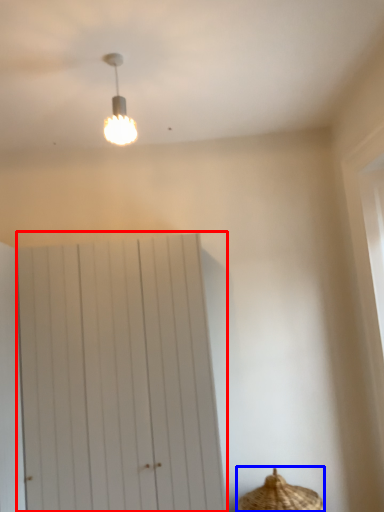
Question: Which of the following is the closest to the observer, barn door (highlighted by a red box) or basket (highlighted by a blue box)?

Choices:
 (A) barn door
 (B) basket

Answer: (B)